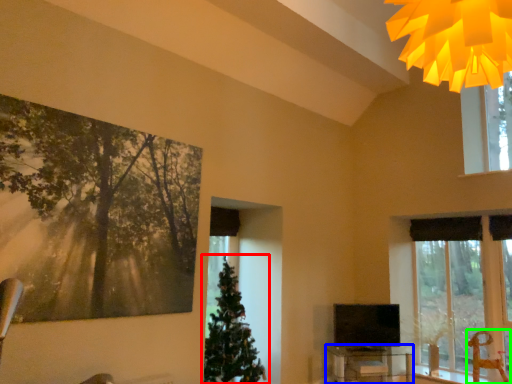
Question: Based on their relative distances, which object is nearer to christmas tree (highlighted by a red box)? Choose from table (highlighted by a blue box) and swivel chair (highlighted by a green box).

Choices:
 (A) table
 (B) swivel chair

Answer: (A)